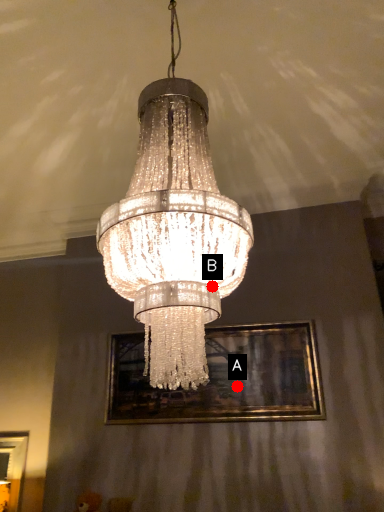
Question: Two points are circled on the image, labeled by A and B beside each circle. Which point is closer to the camera taking this photo?

Choices:
 (A) A is closer
 (B) B is closer

Answer: (B)